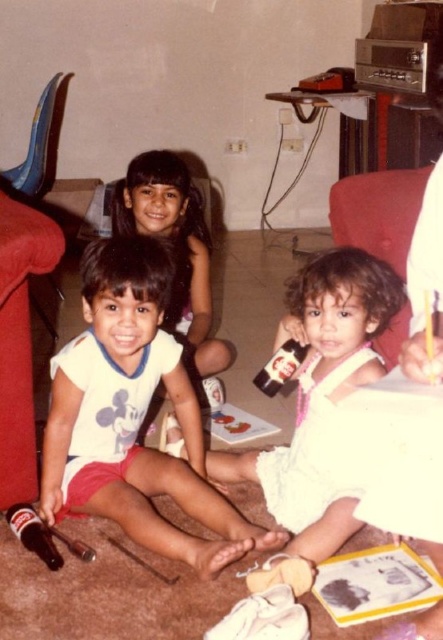
Question: Among these points, which one is nearest to the camera?

Choices:
 (A) (296, 349)
 (B) (54, 550)
 (C) (113, 515)
 (D) (282, 488)

Answer: (B)

Question: Which object is closer to the camera taking this photo?

Choices:
 (A) translucent glass soda at lower left
 (B) white cotton shirt at center
 (C) white cotton dress at center

Answer: (B)

Question: Is white cotton dress at center above matte plastic soda at center?

Choices:
 (A) no
 (B) yes

Answer: (B)

Question: Estimate the real-world distances between objects in this image. Which object is farther from the translucent glass soda at lower left?

Choices:
 (A) matte plastic soda at center
 (B) white cotton shirt at center
 (C) white cotton dress at center

Answer: (A)

Question: Does white cotton dress at center have a greater width compared to matte plastic soda at center?

Choices:
 (A) no
 (B) yes

Answer: (B)

Question: Is white cotton dress at center to the left of matte plastic soda at center from the viewer's perspective?

Choices:
 (A) yes
 (B) no

Answer: (B)